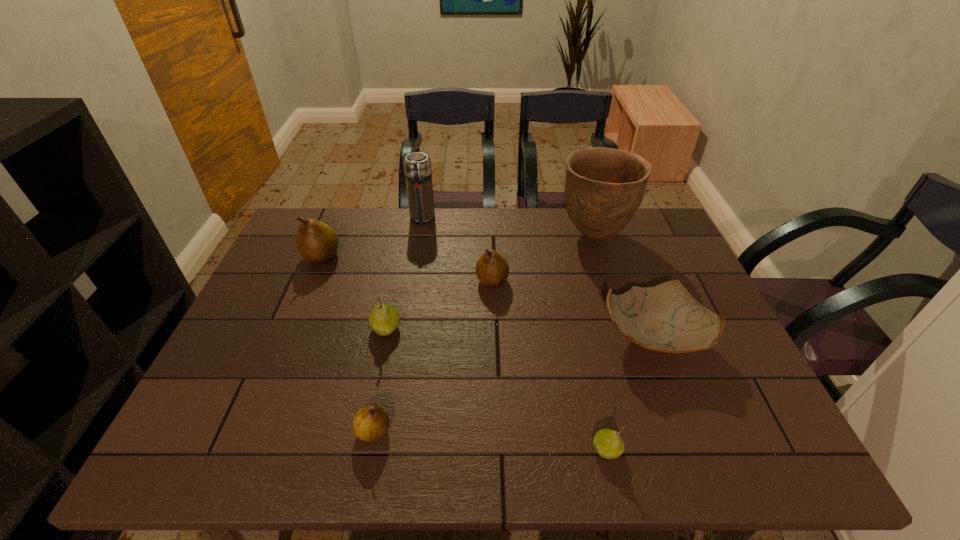
This screenshot has width=960, height=540. In order to click on the taller pottery in this screenshot , I will do `click(604, 187)`.

Find the location of a particular element. The width and height of the screenshot is (960, 540). thermos bottle is located at coordinates (417, 166).

The image size is (960, 540). What are the coordinates of `the tallest pear` in the screenshot? It's located at click(317, 243).

The height and width of the screenshot is (540, 960). I want to click on the biggest brown pear, so click(317, 243).

The height and width of the screenshot is (540, 960). In order to click on the second smallest brown pear in this screenshot , I will do `click(492, 269)`.

This screenshot has height=540, width=960. I want to click on the second pear from right to left, so [492, 269].

Where is `the left green pear`? The height and width of the screenshot is (540, 960). the left green pear is located at coordinates (384, 319).

Where is `the third nearest pear`? This screenshot has height=540, width=960. the third nearest pear is located at coordinates (384, 319).

Locate an element on the screen. This screenshot has width=960, height=540. the shorter pottery is located at coordinates 666,318.

You are a GUI agent. You are given a task and a screenshot of the screen. Output one action in this format:
    pyautogui.click(x=<x>, y=<y>)
    Task: Click on the nearest brown pear
    Image resolution: width=960 pixels, height=540 pixels.
    Given the screenshot: What is the action you would take?
    pyautogui.click(x=371, y=422)